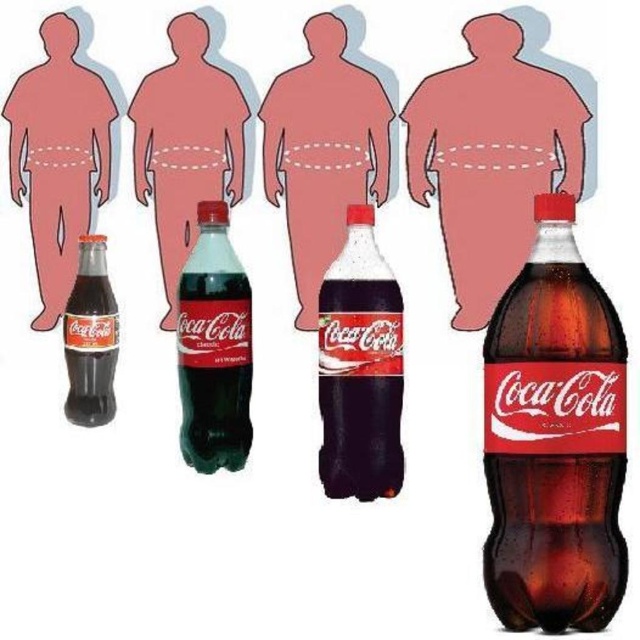
Question: Which of the following is the farthest from the observer?

Choices:
 (A) clear glass bottle at lower left
 (B) brown glass coca-cola bottle at center
 (C) matte glass bottle at lower left
 (D) translucent glass coca-cola bottle at center

Answer: (C)

Question: Which is nearer to the matte glass coca-cola bottle at center?

Choices:
 (A) brown glass coca-cola bottle at center
 (B) matte glass bottle at lower left

Answer: (A)

Question: Does matte glass coca-cola bottle at center have a lesser width compared to matte glass bottle at lower left?

Choices:
 (A) yes
 (B) no

Answer: (B)

Question: Is translucent glass coca-cola bottle at center further to the viewer compared to dark glass coca-cola bottle at center?

Choices:
 (A) no
 (B) yes

Answer: (A)

Question: Does translucent glass coca-cola bottle at center have a greater width compared to matte glass coca-cola bottle at center?

Choices:
 (A) yes
 (B) no

Answer: (B)

Question: Among these objects, which one is farthest from the camera?

Choices:
 (A) matte glass bottle at lower left
 (B) translucent glass coca-cola bottle at center
 (C) dark glass coca-cola bottle at center
 (D) matte glass coca-cola bottle at center

Answer: (A)